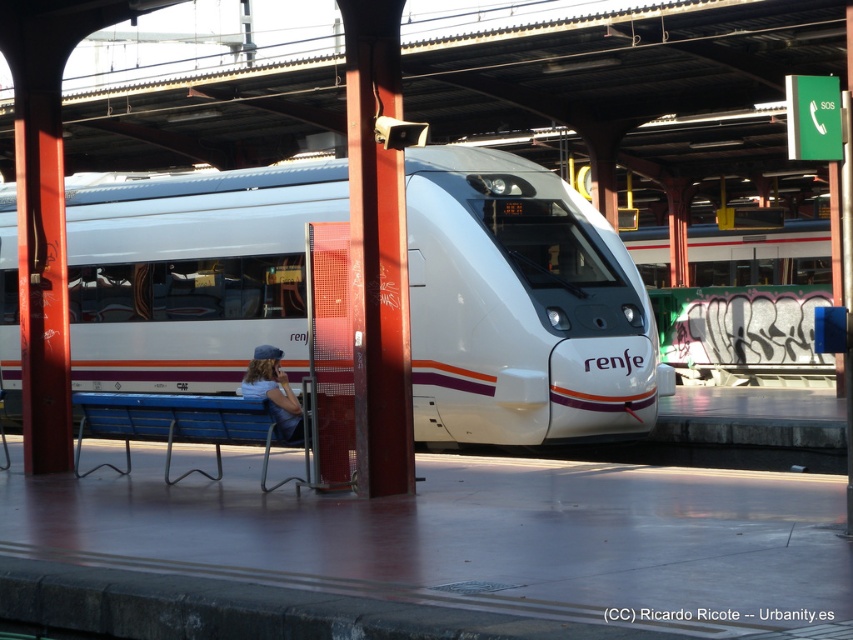
You are a maintenance worker on the platform. You need to inspect the white glossy train at center and the denim cap at center. Which object is closer to you if you are standing at the platform entrance?

The denim cap at center is closer to you because it is only 5.54 meters away from the white glossy train at center, so depending on your position at the entrance, the distances might vary. However, since both objects are at the center, the cap is likely closer as it is smaller and placed nearer to the entrance.

You are a photographer standing on the platform. You want to take a photo of the white glossy train at center and the denim cap at center. Since you want both subjects to be in focus, you need to know their relative sizes. Which object is taller?

The white glossy train at center is much taller than the denim cap at center.